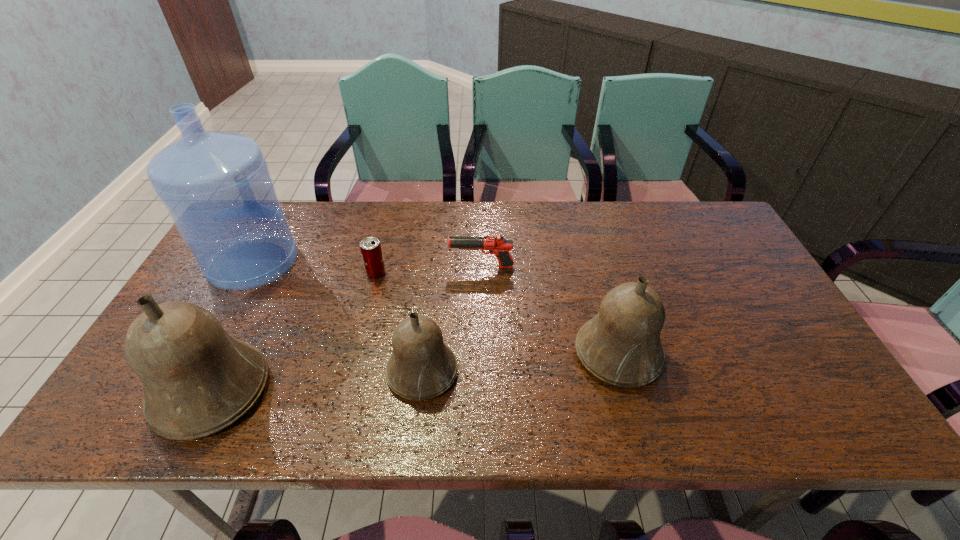
All bells are currently evenly spaced. To continue this pattern, where would you add another bell on the right? Please point out a vacant spot. Please provide its 2D coordinates. Your answer should be formatted as a tuple, i.e. [(x, y)], where the tuple contains the x and y coordinates of a point satisfying the conditions above.

[(801, 336)]